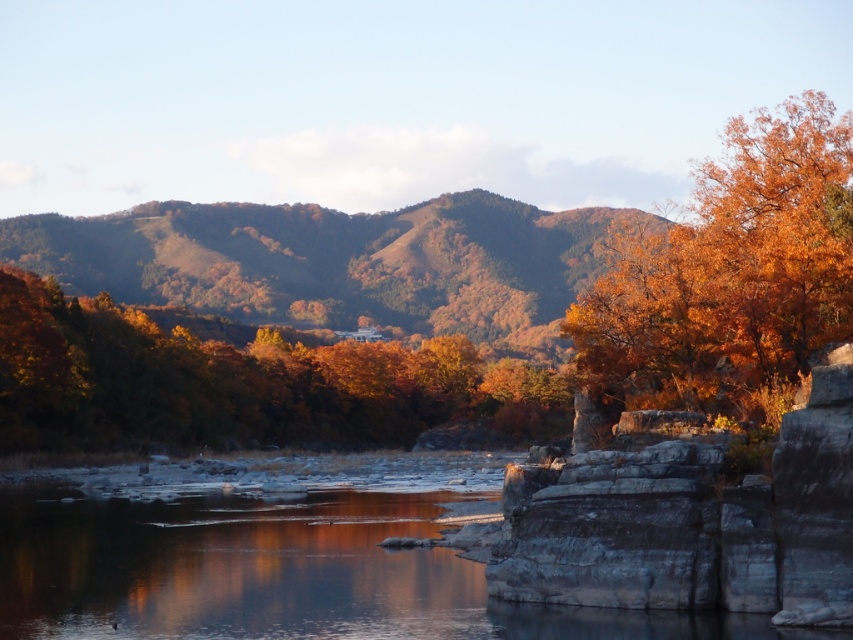
You are standing in front of the serene autumn landscape. You see two areas of golden foliage at center and golden foliage hill at center. Which one appears nearer to you?

The golden foliage at center is closer to the viewer than the golden foliage hill at center.

You are an artist standing at the edge of the river and want to paint the golden foliage at center and the golden foliage hill at center. Which one is positioned to the right of the other?

The golden foliage at center is to the right of the golden foliage hill at center.